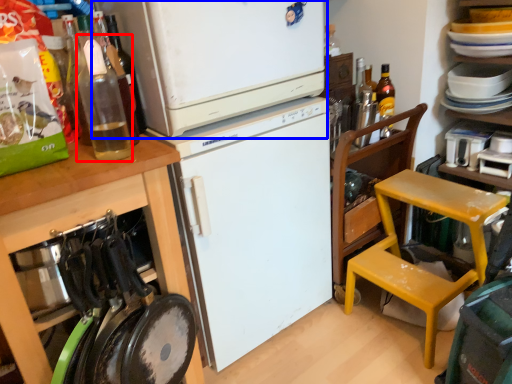
Question: Which point is further to the camera, bottle (highlighted by a red box) or refrigerator (highlighted by a blue box)?

Choices:
 (A) bottle
 (B) refrigerator

Answer: (B)